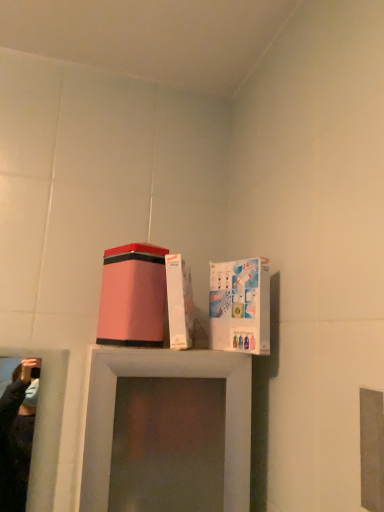
Measure the distance between point (231, 343) and camera.

They are 82.90 centimeters apart.

Locate an element on the screen. white glossy cardboard box at upper right is located at coordinates (240, 306).

What do you see at coordinates (240, 306) in the screenshot? I see `white glossy cardboard box at upper right` at bounding box center [240, 306].

Identify the location of matte pink box at center. (133, 296).

This screenshot has width=384, height=512. What do you see at coordinates (133, 296) in the screenshot? I see `matte pink box at center` at bounding box center [133, 296].

Find the location of a particular element. white glossy cardboard box at upper right is located at coordinates (240, 306).

Can you confirm if white glossy cardboard box at upper right is positioned to the right of matte pink box at center?

Indeed, white glossy cardboard box at upper right is positioned on the right side of matte pink box at center.

Is white glossy cardboard box at upper right further to camera compared to matte pink box at center?

No, it is in front of matte pink box at center.

Does point (255, 335) come farther from viewer compared to point (133, 334)?

No, (255, 335) is in front of (133, 334).

From the image's perspective, is white glossy cardboard box at upper right on matte pink box at center?

No, from the image's perspective, white glossy cardboard box at upper right is not over matte pink box at center.

From a real-world perspective, is white glossy cardboard box at upper right positioned above or below matte pink box at center?

Clearly, from a real-world perspective, white glossy cardboard box at upper right is below matte pink box at center.

From the picture: Considering the sizes of white glossy cardboard box at upper right and matte pink box at center in the image, is white glossy cardboard box at upper right wider or thinner than matte pink box at center?

Clearly, white glossy cardboard box at upper right has less width compared to matte pink box at center.

Considering the sizes of objects white glossy cardboard box at upper right and matte pink box at center in the image provided, who is taller, white glossy cardboard box at upper right or matte pink box at center?

Standing taller between the two is white glossy cardboard box at upper right.

Is white glossy cardboard box at upper right bigger than matte pink box at center?

No, white glossy cardboard box at upper right is not bigger than matte pink box at center.

Would you say white glossy cardboard box at upper right is inside or outside matte pink box at center?

white glossy cardboard box at upper right is not inside matte pink box at center, it's outside.

Is white glossy cardboard box at upper right far away from matte pink box at center?

That's not correct — white glossy cardboard box at upper right is a little close to matte pink box at center.

Could you tell me if white glossy cardboard box at upper right is facing matte pink box at center?

No, white glossy cardboard box at upper right is not turned towards matte pink box at center.

The image size is (384, 512). In order to click on cardboard box that appears below the matte pink box at center (from a real-world perspective) in this screenshot , I will do `click(240, 306)`.

Is matte pink box at center to the left of white glossy cardboard box at upper right from the viewer's perspective?

Yes.

Considering their positions, is matte pink box at center located in front of or behind white glossy cardboard box at upper right?

In the image, matte pink box at center appears behind white glossy cardboard box at upper right.

Does point (106, 294) come in front of point (246, 338)?

No, it is not.

From the image's perspective, is matte pink box at center on white glossy cardboard box at upper right?

Yes, from the image's perspective, matte pink box at center is on top of white glossy cardboard box at upper right.

From a real-world perspective, who is located higher, matte pink box at center or white glossy cardboard box at upper right?

matte pink box at center is physically above.

Is matte pink box at center thinner than white glossy cardboard box at upper right?

No.

Does matte pink box at center have a greater height compared to white glossy cardboard box at upper right?

No, matte pink box at center is not taller than white glossy cardboard box at upper right.

Considering the sizes of objects matte pink box at center and white glossy cardboard box at upper right in the image provided, who is smaller, matte pink box at center or white glossy cardboard box at upper right?

white glossy cardboard box at upper right is smaller.

Looking at this image, choose the correct answer: Is matte pink box at center inside white glossy cardboard box at upper right or outside it?

matte pink box at center is not inside white glossy cardboard box at upper right, it's outside.

Is matte pink box at center far from white glossy cardboard box at upper right?

No, matte pink box at center is not far from white glossy cardboard box at upper right.

Is white glossy cardboard box at upper right at the back of matte pink box at center?

matte pink box at center does not have its back to white glossy cardboard box at upper right.

The width and height of the screenshot is (384, 512). Identify the location of box positioned vertically above the white glossy cardboard box at upper right (from a real-world perspective). (133, 296).

I want to click on box behind the white glossy cardboard box at upper right, so click(x=133, y=296).

The width and height of the screenshot is (384, 512). I want to click on cardboard box located below the matte pink box at center (from the image's perspective), so click(x=240, y=306).